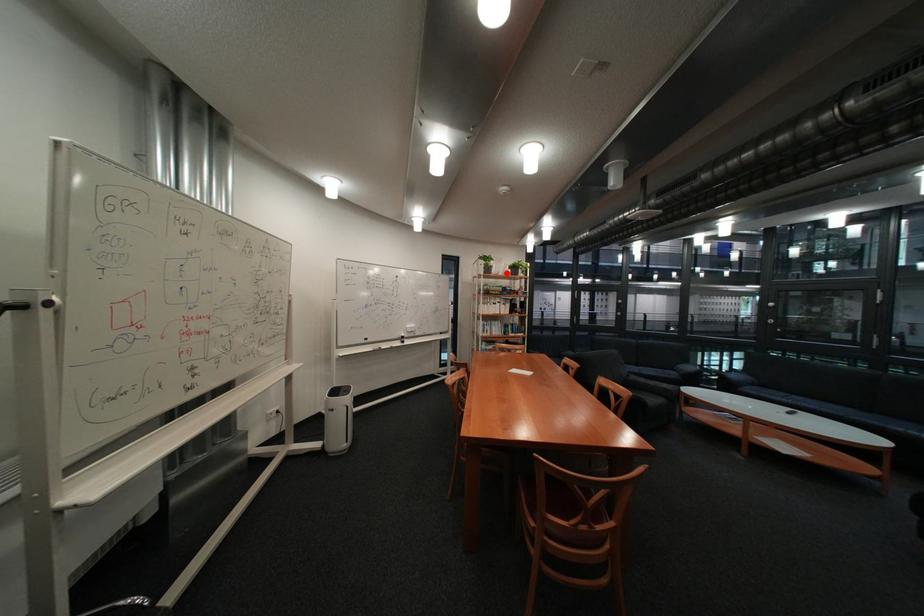
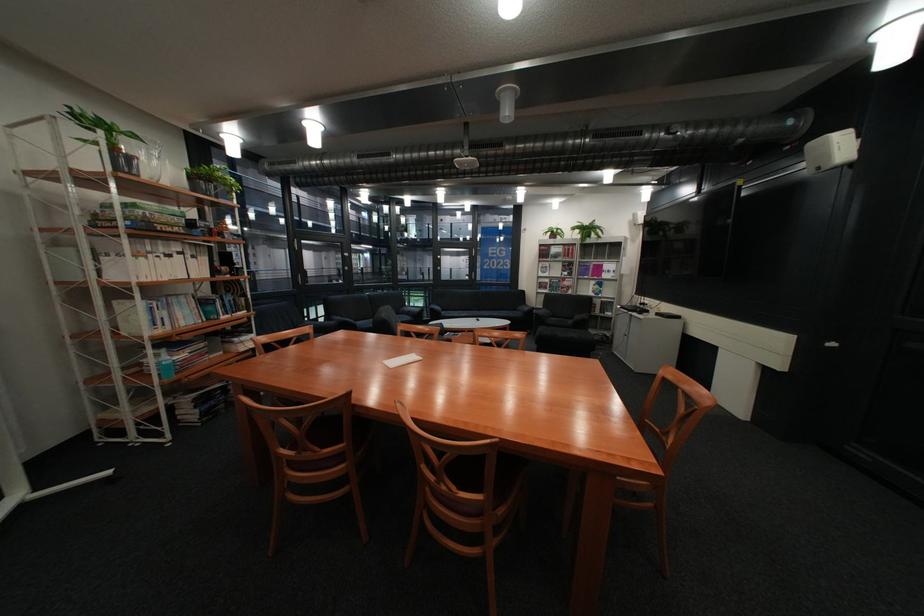
The point at the highlighted location is marked in the first image. Where is the corresponding point in the second image?

(152, 177)